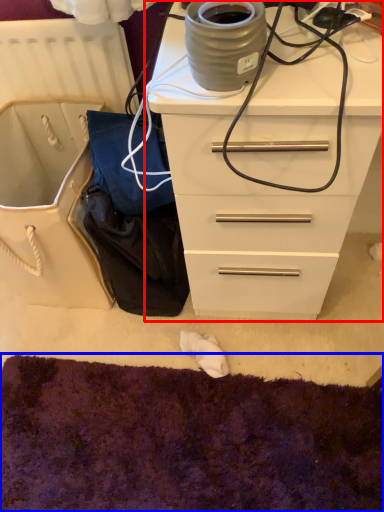
Question: Which object appears farthest to the camera in this image, chest of drawers (highlighted by a red box) or cat bed (highlighted by a blue box)?

Choices:
 (A) chest of drawers
 (B) cat bed

Answer: (B)